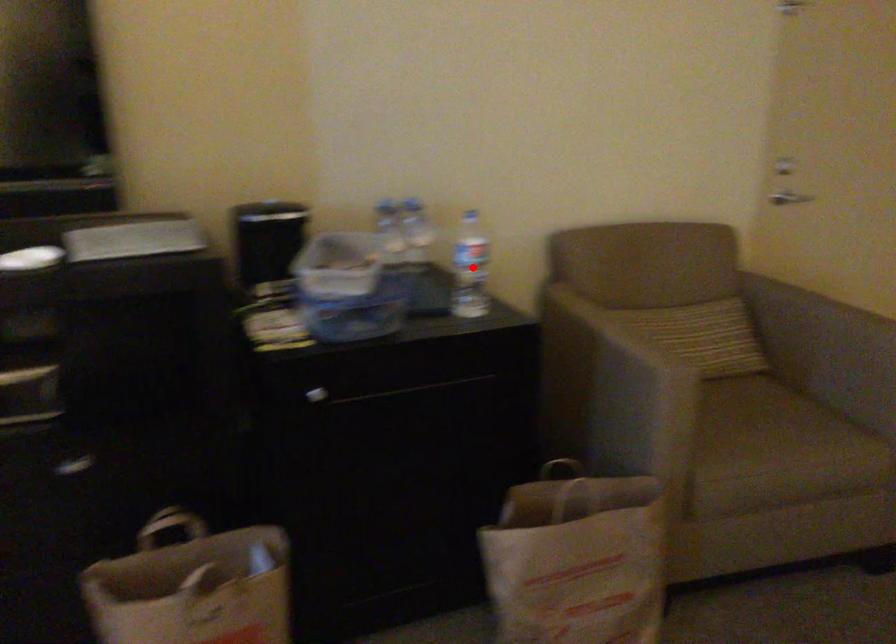
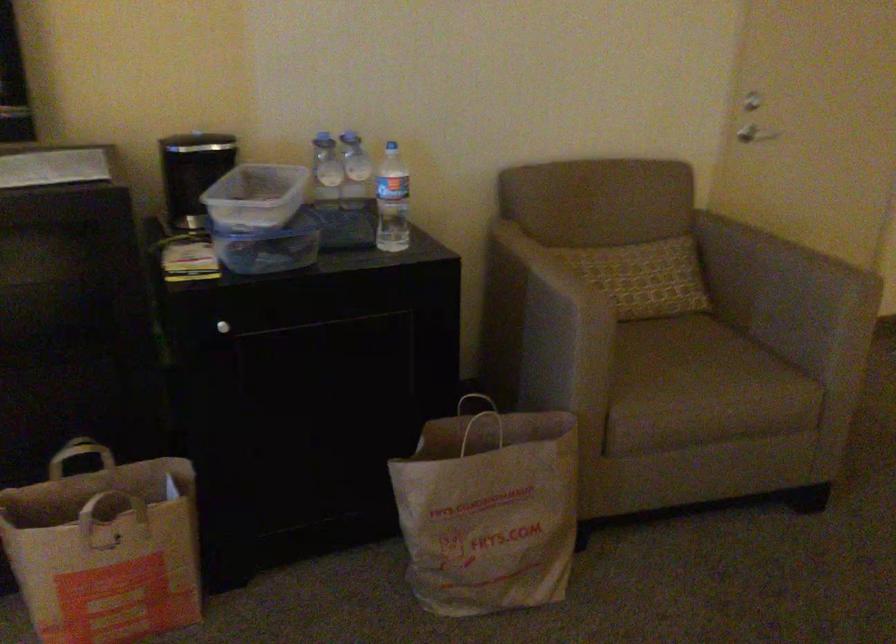
Locate, in the second image, the point that corresponds to the highlighted location in the first image.

(391, 201)